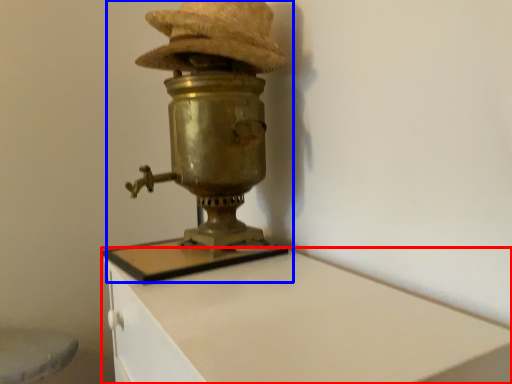
Question: Which object is closer to the camera taking this photo, furniture (highlighted by a red box) or table lamp (highlighted by a blue box)?

Choices:
 (A) furniture
 (B) table lamp

Answer: (A)